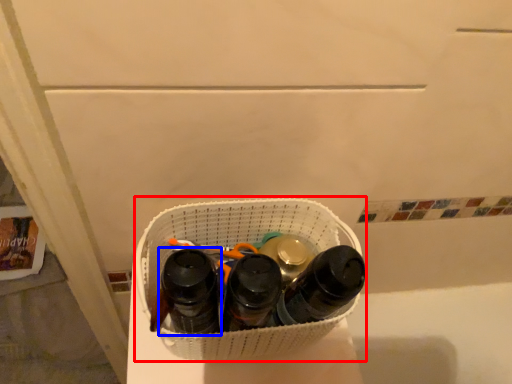
Question: Which object is further to the camera taking this photo, laundry basket (highlighted by a red box) or footwear (highlighted by a blue box)?

Choices:
 (A) laundry basket
 (B) footwear

Answer: (A)